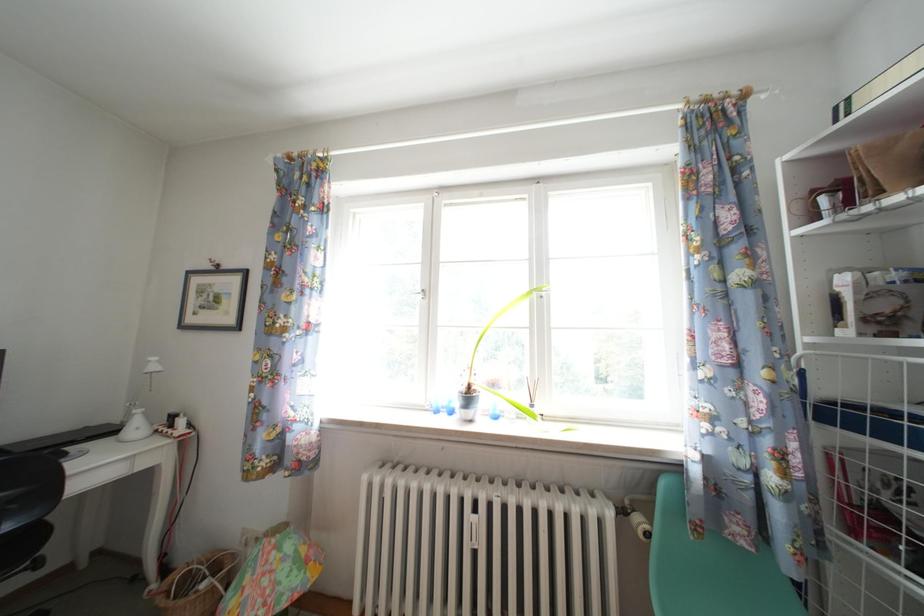
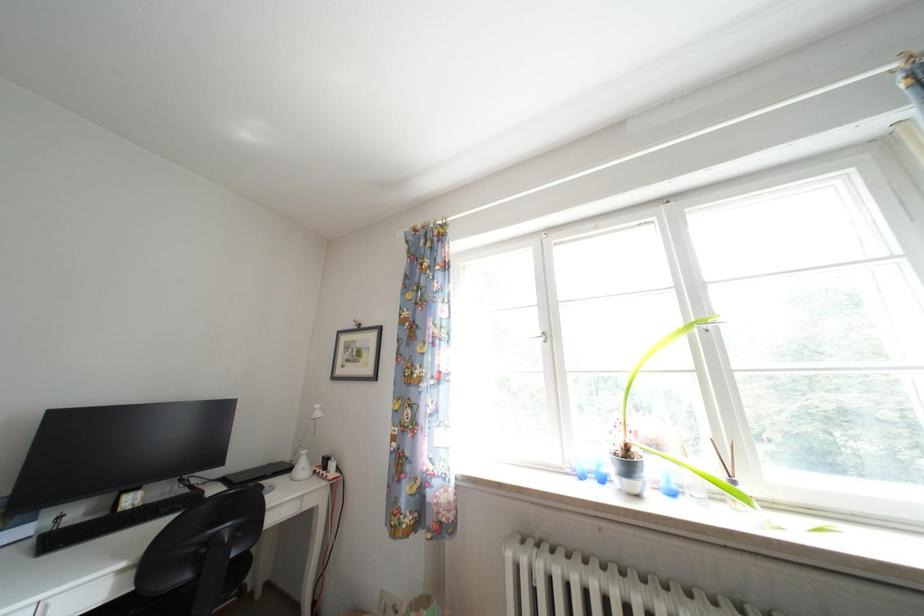
Question: The images are taken continuously from a first-person perspective. In which direction is your viewpoint rotating?

Choices:
 (A) Left
 (B) Right
 (C) Up
 (D) Down

Answer: (A)